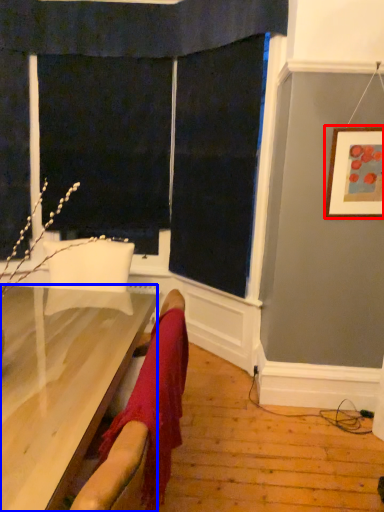
Question: Which object is further to the camera taking this photo, picture frame (highlighted by a red box) or furniture (highlighted by a blue box)?

Choices:
 (A) picture frame
 (B) furniture

Answer: (A)